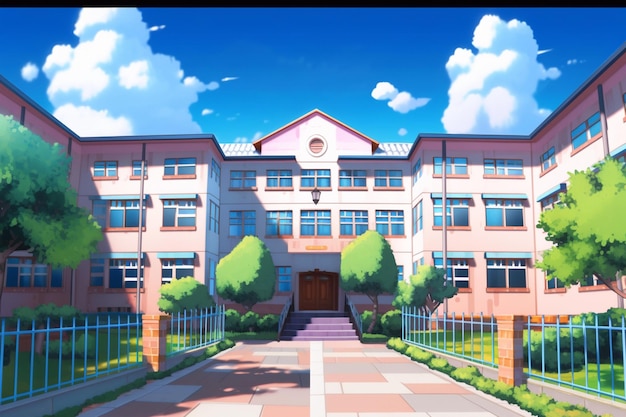
Image resolution: width=626 pixels, height=417 pixels. In order to click on wall in this screenshot , I will do `click(514, 241)`.